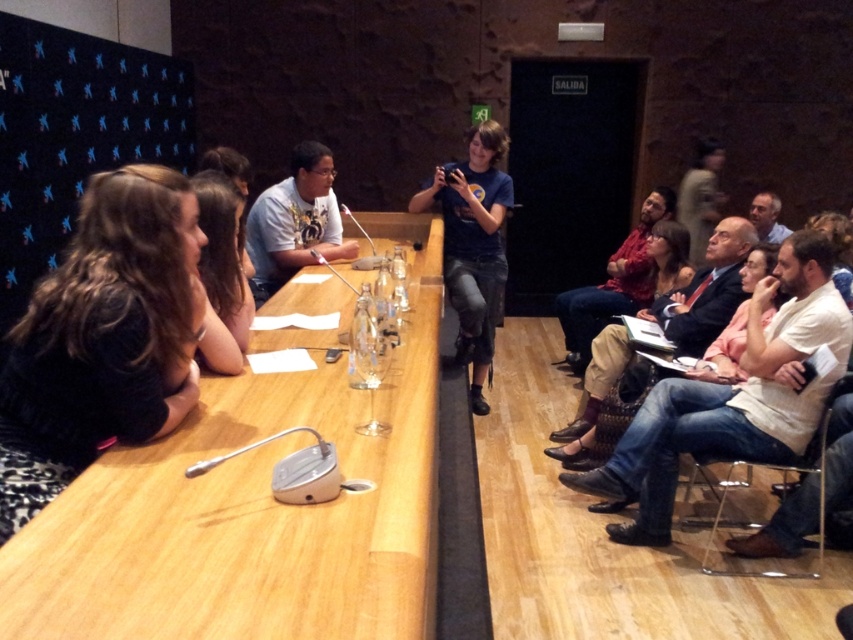
Question: Which object appears closest to the camera in this image?

Choices:
 (A) matte white shirt at center
 (B) white cotton shirt at right

Answer: (B)

Question: Based on their relative distances, which object is farther from the blue t-shirt at center?

Choices:
 (A) white cotton shirt at right
 (B) light brown leather shoes at lower right

Answer: (A)

Question: Can you confirm if wooden table at center is positioned above white cotton shirt at right?

Choices:
 (A) no
 (B) yes

Answer: (B)

Question: Can you confirm if light brown leather shoes at lower right is smaller than matte white shirt at center?

Choices:
 (A) yes
 (B) no

Answer: (B)

Question: Is white cotton shirt at right thinner than light brown leather shoes at lower right?

Choices:
 (A) yes
 (B) no

Answer: (A)

Question: Estimate the real-world distances between objects in this image. Which object is farther from the wooden table at center?

Choices:
 (A) white cotton shirt at right
 (B) light brown leather shoes at lower right
 (C) red shirt at right

Answer: (C)